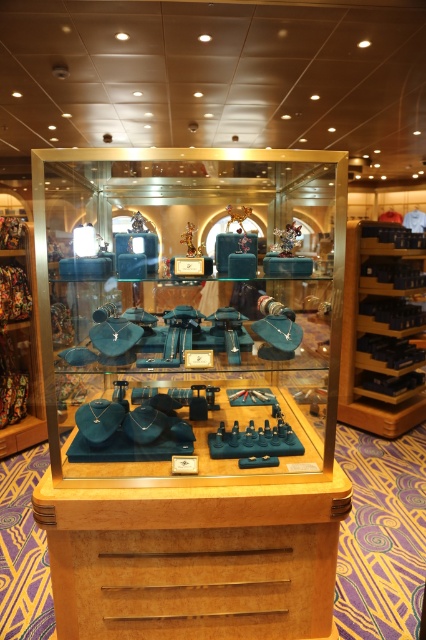
From the picture: Who is more distant from viewer, (132, 221) or (293, 236)?

Point (293, 236)

Can you confirm if matte blue jewelry box at center is positioned below matte blue figurine at center?

Indeed, matte blue jewelry box at center is positioned under matte blue figurine at center.

Find the location of a particular element. matte blue jewelry box at center is located at coordinates (137, 250).

The width and height of the screenshot is (426, 640). Identify the location of matte blue jewelry box at center. (137, 250).